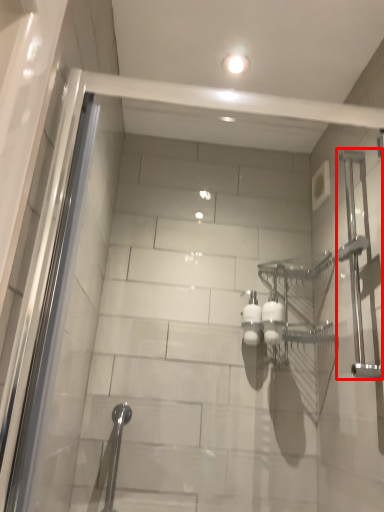
Question: From the image's perspective, what is the correct spatial positioning of shower (annotated by the red box) in reference to shower?

Choices:
 (A) above
 (B) below

Answer: (A)